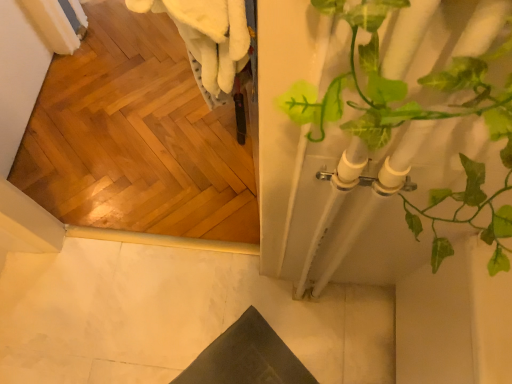
Identify the location of green leafy plant at right. 409,127.

This screenshot has height=384, width=512. Describe the element at coordinates (409, 127) in the screenshot. I see `green leafy plant at right` at that location.

Locate an element on the screen. white marble floor at lower left is located at coordinates (173, 315).

This screenshot has height=384, width=512. Describe the element at coordinates (173, 315) in the screenshot. I see `white marble floor at lower left` at that location.

Measure the distance between white marble floor at lower left and camera.

A distance of 3.65 feet exists between white marble floor at lower left and camera.

The width and height of the screenshot is (512, 384). Identify the location of green leafy plant at right. (409, 127).

In the scene shown: In the image, is green leafy plant at right on the left side or the right side of white marble floor at lower left?

Clearly, green leafy plant at right is on the right of white marble floor at lower left in the image.

Which is behind, green leafy plant at right or white marble floor at lower left?

Positioned behind is white marble floor at lower left.

Which is closer, (312, 164) or (131, 297)?

Clearly, point (312, 164) is closer to the camera than point (131, 297).

From the image's perspective, relative to white marble floor at lower left, is green leafy plant at right above or below?

Clearly, from the image's perspective, green leafy plant at right is above white marble floor at lower left.

From a real-world perspective, does green leafy plant at right stand above white marble floor at lower left?

Correct, in the physical world, green leafy plant at right is higher than white marble floor at lower left.

Considering the sizes of objects green leafy plant at right and white marble floor at lower left in the image provided, who is wider, green leafy plant at right or white marble floor at lower left?

With larger width is white marble floor at lower left.

Who is taller, green leafy plant at right or white marble floor at lower left?

green leafy plant at right is taller.

Considering the relative sizes of green leafy plant at right and white marble floor at lower left in the image provided, is green leafy plant at right bigger than white marble floor at lower left?

Indeed, green leafy plant at right has a larger size compared to white marble floor at lower left.

Based on the photo, is green leafy plant at right inside or outside of white marble floor at lower left?

The correct answer is: outside.

Would you consider green leafy plant at right to be distant from white marble floor at lower left?

green leafy plant at right is actually quite close to white marble floor at lower left.

Could you tell me if green leafy plant at right is turned towards white marble floor at lower left?

No, green leafy plant at right is not oriented towards white marble floor at lower left.

What's the angular difference between green leafy plant at right and white marble floor at lower left's facing directions?

The angle between the facing direction of green leafy plant at right and the facing direction of white marble floor at lower left is 179 degrees.

The image size is (512, 384). I want to click on concrete lying below the green leafy plant at right (from the image's perspective), so click(x=173, y=315).

Considering the relative positions of white marble floor at lower left and green leafy plant at right in the image provided, is white marble floor at lower left to the left or to the right of green leafy plant at right?

In the image, white marble floor at lower left appears on the left side of green leafy plant at right.

Which object is further away from the camera, white marble floor at lower left or green leafy plant at right?

white marble floor at lower left.

Considering the points (61, 318) and (435, 166), which point is in front, point (61, 318) or point (435, 166)?

The point (435, 166) is closer.

From the image's perspective, would you say white marble floor at lower left is positioned over green leafy plant at right?

Incorrect, from the image's perspective, white marble floor at lower left is lower than green leafy plant at right.

From a real-world perspective, which object rests below the other?

white marble floor at lower left is physically lower.

Based on the photo, considering the sizes of objects white marble floor at lower left and green leafy plant at right in the image provided, who is thinner, white marble floor at lower left or green leafy plant at right?

green leafy plant at right.

Does white marble floor at lower left have a lesser height compared to green leafy plant at right?

Indeed, white marble floor at lower left has a lesser height compared to green leafy plant at right.

Is white marble floor at lower left bigger than green leafy plant at right?

No, white marble floor at lower left is not bigger than green leafy plant at right.

In the scene shown: Is white marble floor at lower left completely or partially outside of green leafy plant at right?

white marble floor at lower left lies outside green leafy plant at right's area.

In the scene shown: Is the surface of white marble floor at lower left in direct contact with green leafy plant at right?

No, white marble floor at lower left is not making contact with green leafy plant at right.

Is white marble floor at lower left oriented towards green leafy plant at right?

No, white marble floor at lower left is not turned towards green leafy plant at right.

What's the angular difference between white marble floor at lower left and green leafy plant at right's facing directions?

The angle between the facing direction of white marble floor at lower left and the facing direction of green leafy plant at right is 179 degrees.

Measure the distance from white marble floor at lower left to green leafy plant at right.

A distance of 71.07 centimeters exists between white marble floor at lower left and green leafy plant at right.

Where is `houseplant above the white marble floor at lower left (from a real-world perspective)`? houseplant above the white marble floor at lower left (from a real-world perspective) is located at coordinates (409, 127).

Image resolution: width=512 pixels, height=384 pixels. I want to click on houseplant that appears in front of the white marble floor at lower left, so [409, 127].

The width and height of the screenshot is (512, 384). I want to click on houseplant that appears above the white marble floor at lower left (from a real-world perspective), so click(409, 127).